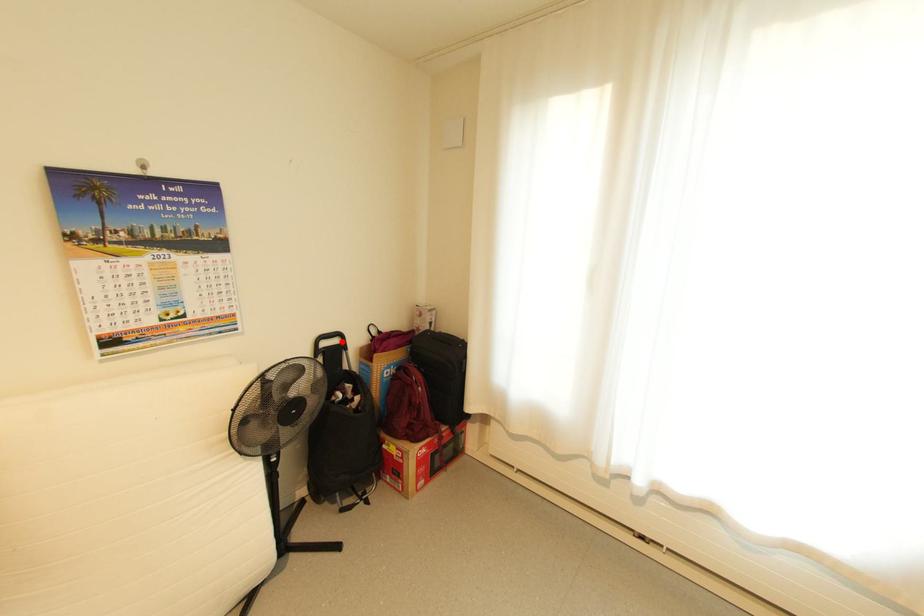
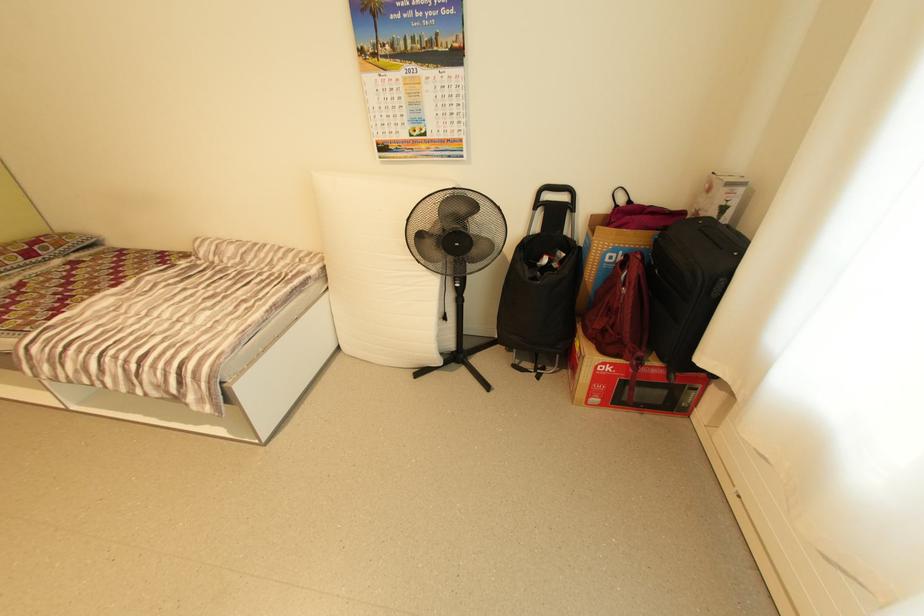
The point at the highlighted location is marked in the first image. Where is the corresponding point in the second image?

(570, 198)